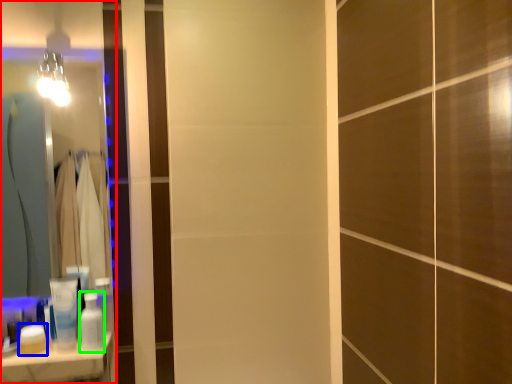
Question: Which object is the farthest from mirror (highlighted by a red box)? Choose among these: toiletry (highlighted by a blue box) or toiletry (highlighted by a green box).

Choices:
 (A) toiletry
 (B) toiletry

Answer: (A)